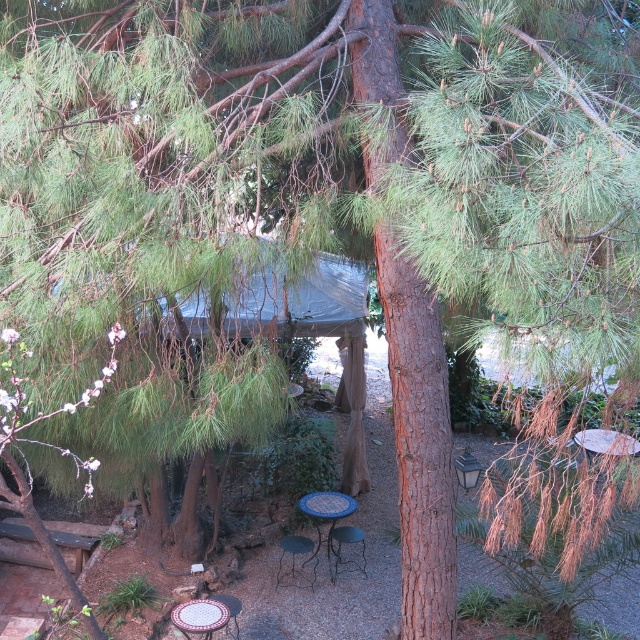
Who is higher up, mosaic tile picnic table at lower center or blue mosaic table at center?

blue mosaic table at center is above.

Is mosaic tile picnic table at lower center taller than blue mosaic table at center?

No.

Which is in front, point (177, 611) or point (324, 502)?

Point (177, 611)

The image size is (640, 640). I want to click on mosaic tile picnic table at lower center, so click(204, 614).

Does metallic mesh chair at center come behind blue mosaic table at center?

That is False.

At what (x,y) coordinates should I click in order to perform the action: click on metallic mesh chair at center. Please return your answer as a coordinate pair (x, y). Looking at the image, I should click on coord(296,563).

Looking at this image, is blue mosaic table at center bigger than mosaic tile chair at lower center?

Yes.

Measure the distance between point (332, 497) and camera.

Point (332, 497) is 7.87 meters from camera.

At what (x,y) coordinates should I click in order to perform the action: click on blue mosaic table at center. Please return your answer as a coordinate pair (x, y). This screenshot has height=640, width=640. Looking at the image, I should click on (326, 506).